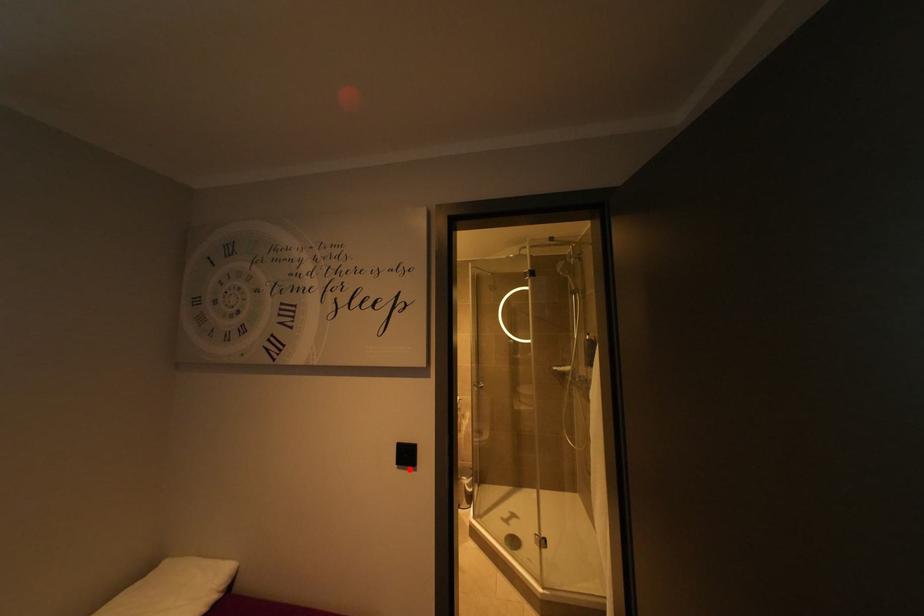
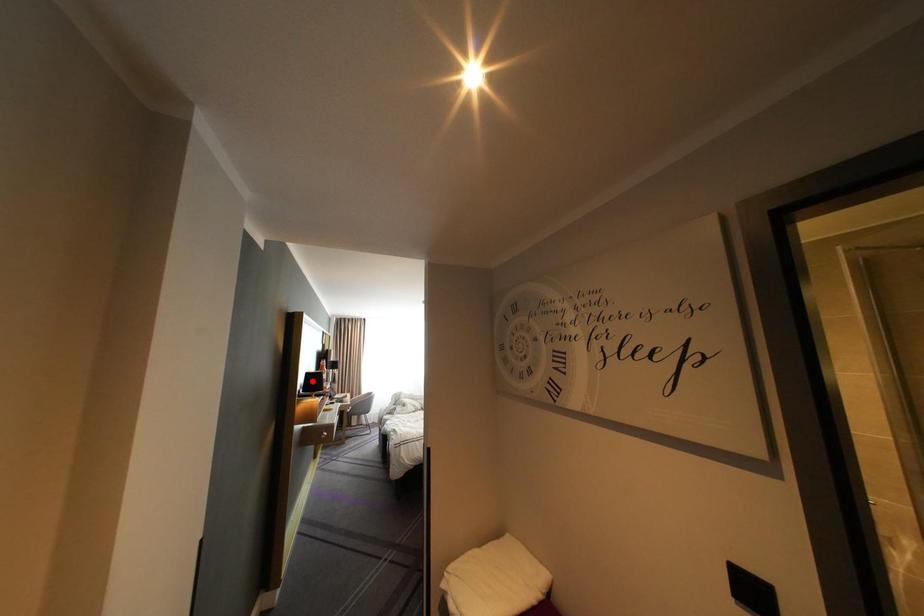
I am providing you with two images of the same scene from different viewpoints. A red point is marked on the first image and another point is marked on the second image. Is the red point in image1 aligned with the point shown in image2?

No